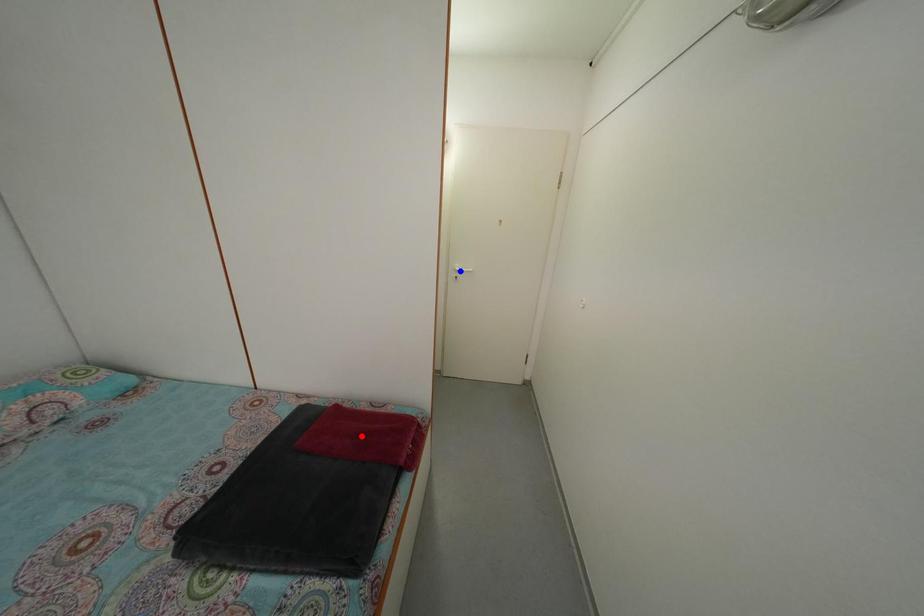
Question: Which of the two points in the image is closer to the camera?

Choices:
 (A) Blue point is closer.
 (B) Red point is closer.

Answer: (B)